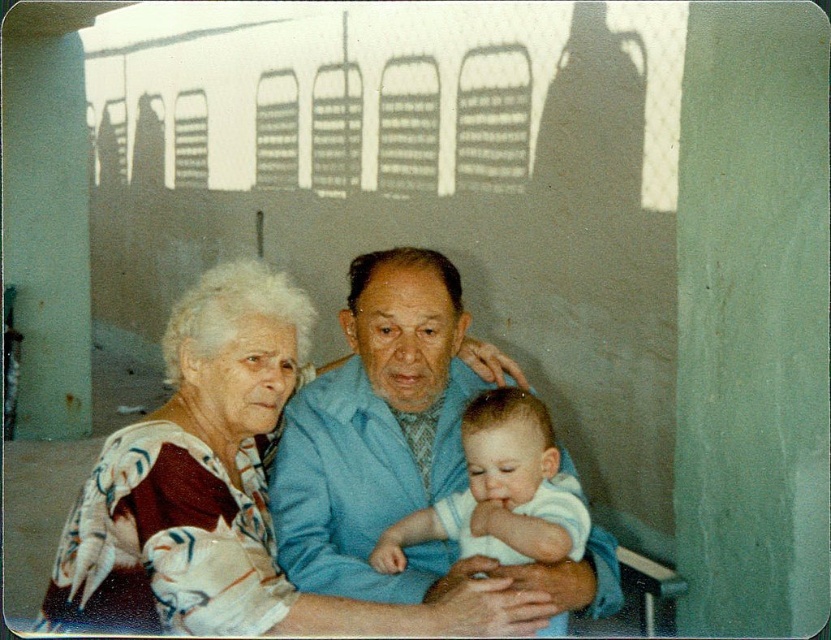
Who is shorter, blue fabric jacket at center or white soft fabric baby at center?

Standing shorter between the two is white soft fabric baby at center.

Does blue fabric jacket at center appear over white soft fabric baby at center?

Indeed, blue fabric jacket at center is positioned over white soft fabric baby at center.

You are a GUI agent. You are given a task and a screenshot of the screen. Output one action in this format:
    pyautogui.click(x=<x>, y=<y>)
    Task: Click on the blue fabric jacket at center
    The image size is (831, 640).
    Given the screenshot: What is the action you would take?
    pyautogui.click(x=397, y=449)

Can you confirm if printed fabric shawl at center is thinner than blue fabric jacket at center?

Incorrect, printed fabric shawl at center's width is not less than blue fabric jacket at center's.

Does printed fabric shawl at center appear under blue fabric jacket at center?

Incorrect, printed fabric shawl at center is not positioned below blue fabric jacket at center.

Is point (323, 620) behind point (376, 509)?

No, (323, 620) is closer to viewer.

I want to click on printed fabric shawl at center, so click(225, 492).

Who is positioned more to the right, printed fabric shawl at center or white soft fabric baby at center?

white soft fabric baby at center is more to the right.

In the scene shown: Is printed fabric shawl at center shorter than white soft fabric baby at center?

No, printed fabric shawl at center is not shorter than white soft fabric baby at center.

Is point (257, 426) in front of point (514, 554)?

That is False.

Where is `printed fabric shawl at center`? Image resolution: width=831 pixels, height=640 pixels. printed fabric shawl at center is located at coordinates coord(225,492).